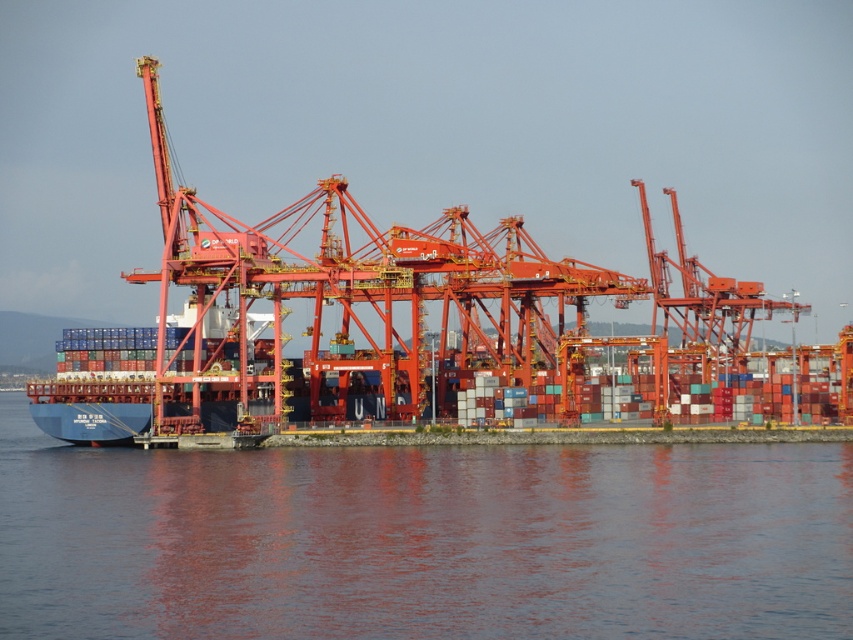
Question: Is transparent water at lower center thinner than metallic orange crane at center?

Choices:
 (A) yes
 (B) no

Answer: (A)

Question: Which object appears closest to the camera in this image?

Choices:
 (A) metallic orange crane at center
 (B) transparent water at lower center

Answer: (B)

Question: Can you confirm if transparent water at lower center is smaller than metallic orange crane at center?

Choices:
 (A) yes
 (B) no

Answer: (A)

Question: Can you confirm if transparent water at lower center is bigger than metallic orange crane at center?

Choices:
 (A) no
 (B) yes

Answer: (A)